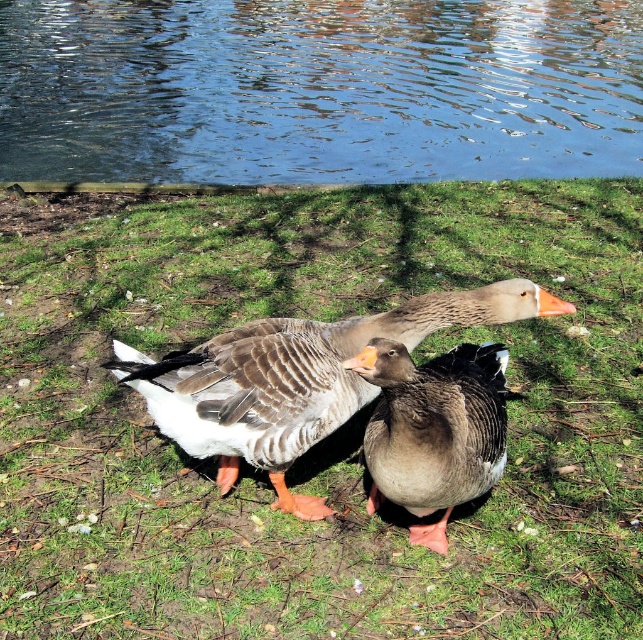
What do you see at coordinates (329, 435) in the screenshot? This screenshot has width=643, height=640. I see `green grassy at center` at bounding box center [329, 435].

Is green grassy at center to the left of gray feathered duck at center from the viewer's perspective?

Yes, green grassy at center is to the left of gray feathered duck at center.

Where is `green grassy at center`? This screenshot has height=640, width=643. green grassy at center is located at coordinates (329, 435).

Is point (131, 264) farther from viewer compared to point (386, 132)?

No, (131, 264) is in front of (386, 132).

Looking at this image, between green grassy at center and blue reflective water at upper center, which one appears on the right side from the viewer's perspective?

blue reflective water at upper center

You are a GUI agent. You are given a task and a screenshot of the screen. Output one action in this format:
    pyautogui.click(x=<x>, y=<y>)
    Task: Click on the green grassy at center
    This screenshot has height=640, width=643.
    Given the screenshot: What is the action you would take?
    pyautogui.click(x=329, y=435)

This screenshot has width=643, height=640. Identify the location of green grassy at center. (329, 435).

Which of these two, blue reflective water at upper center or gray matte duck at center, stands shorter?

gray matte duck at center is shorter.

This screenshot has height=640, width=643. What do you see at coordinates (320, 90) in the screenshot?
I see `blue reflective water at upper center` at bounding box center [320, 90].

Image resolution: width=643 pixels, height=640 pixels. What are the coordinates of `blue reflective water at upper center` in the screenshot? It's located at (320, 90).